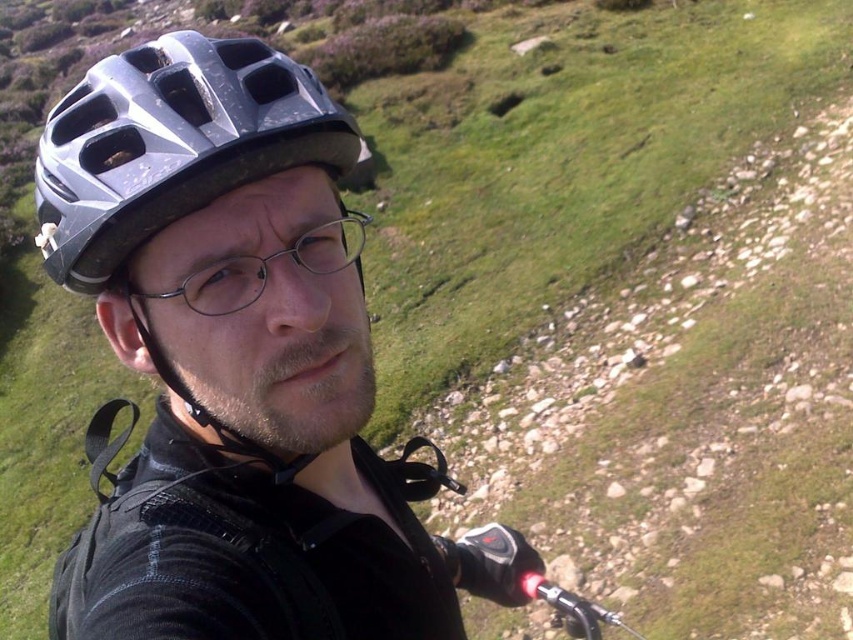
You are a photographer trying to capture a closeup of the metallic helmet at center and the clear plastic glasses at center. Since you want to focus on the helmet, which object should you adjust your camera focus to prioritize and why?

The metallic helmet at center has a larger size compared to clear plastic glasses at center, so you should prioritize focusing on the metallic helmet at center because its larger size makes it more prominent in the frame.

You are a drone operator trying to capture a photo of the metallic helmet at center. The drone is currently hovering at point (238, 365). Is the drone positioned correctly to take a clear photo of the metallic helmet at center?

Yes, the drone is positioned correctly because point (238, 365) corresponds to the metallic helmet at center.